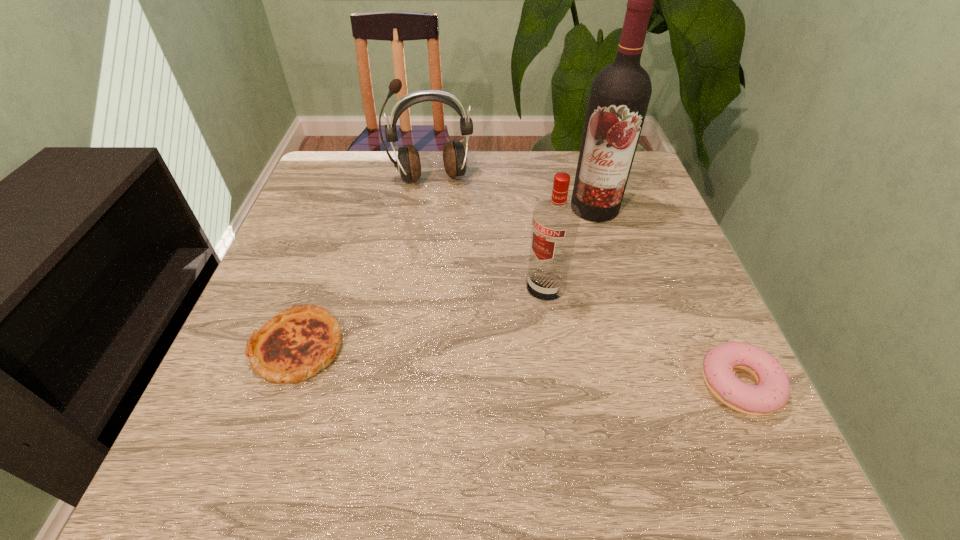
The height and width of the screenshot is (540, 960). Find the location of `free space located on the front label of the vodka`. free space located on the front label of the vodka is located at coordinates (429, 397).

Locate an element on the screen. This screenshot has height=540, width=960. earphone present at the far edge is located at coordinates (407, 162).

Locate an element on the screen. wine bottle situated at the far edge is located at coordinates (619, 97).

This screenshot has width=960, height=540. Identify the location of quiche positioned at the near edge. (294, 345).

This screenshot has height=540, width=960. Identify the location of doughnut that is at the near edge. (771, 393).

Identify the location of object that is at the left edge. The height and width of the screenshot is (540, 960). tap(294, 345).

What are the coordinates of `doughnut that is at the right edge` in the screenshot? It's located at (771, 393).

Find the location of a particular element. The width and height of the screenshot is (960, 540). wine bottle located at the right edge is located at coordinates (619, 97).

The width and height of the screenshot is (960, 540). In order to click on object that is positioned at the near left corner in this screenshot , I will do `click(294, 345)`.

Where is `object present at the far right corner`? The image size is (960, 540). object present at the far right corner is located at coordinates (619, 97).